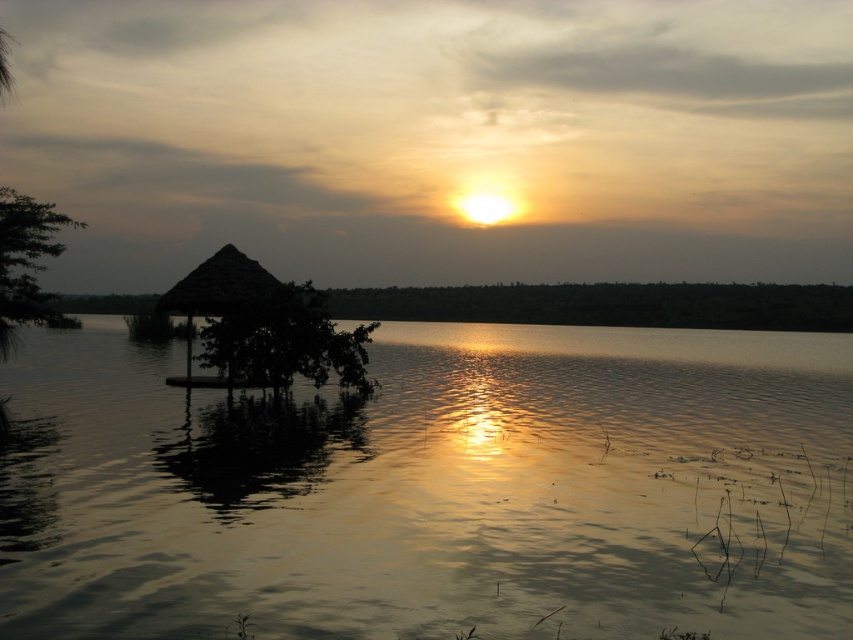
Question: Which of the following is the closest to the observer?

Choices:
 (A) (190, 332)
 (B) (788, 358)

Answer: (A)

Question: Can you confirm if matte thatched hut at left is wider than thatched straw hut at center?

Choices:
 (A) no
 (B) yes

Answer: (B)

Question: From the image, what is the correct spatial relationship of matte thatched hut at left in relation to thatched straw hut at center?

Choices:
 (A) above
 (B) below

Answer: (B)

Question: Which of the following is the farthest from the observer?

Choices:
 (A) thatched straw hut at center
 (B) matte thatched hut at left

Answer: (A)

Question: Does matte thatched hut at left have a smaller size compared to thatched straw hut at center?

Choices:
 (A) yes
 (B) no

Answer: (B)